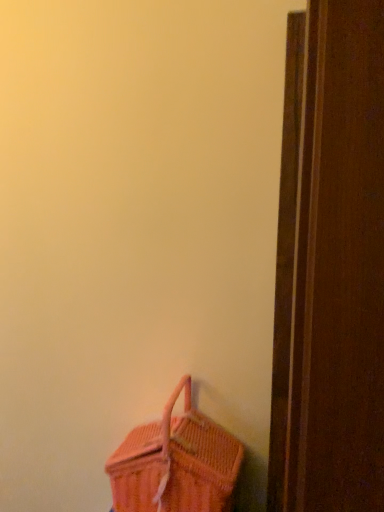
Identify the location of pink wicker picnic basket at lower left. The height and width of the screenshot is (512, 384). (176, 463).

Image resolution: width=384 pixels, height=512 pixels. Describe the element at coordinates (176, 463) in the screenshot. I see `pink wicker picnic basket at lower left` at that location.

Locate an element on the screen. pink wicker picnic basket at lower left is located at coordinates (176, 463).